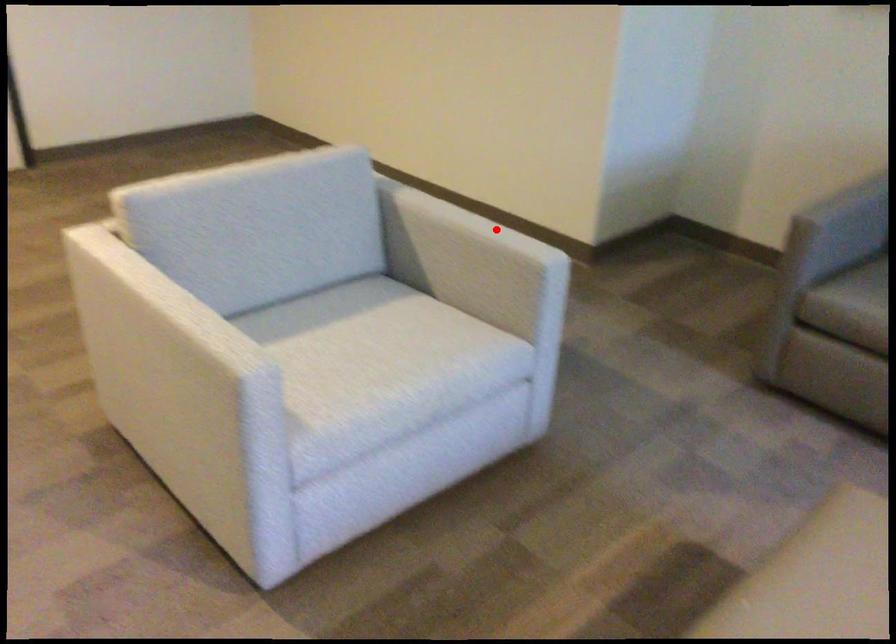
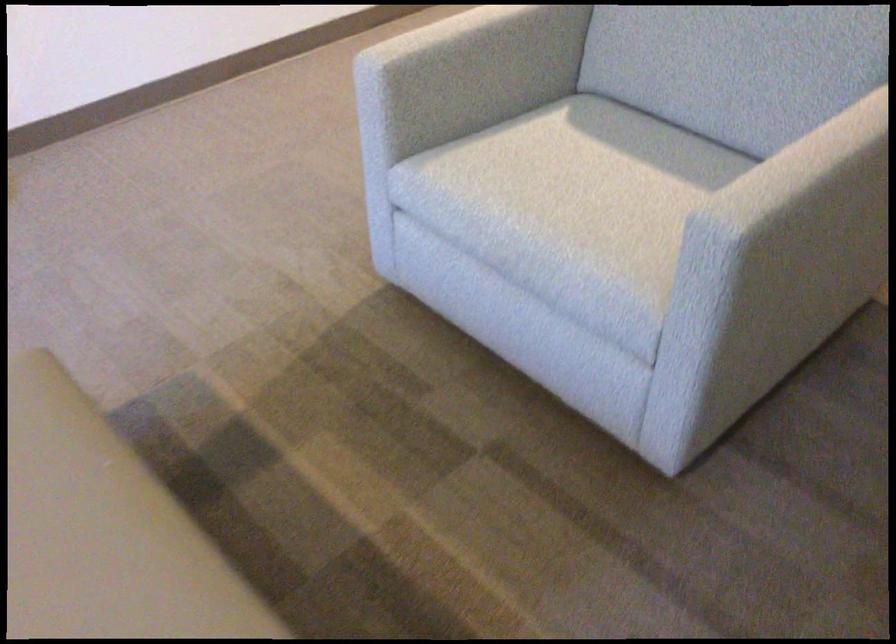
Question: I am providing you with two images of the same scene from different viewpoints. A red point is shown in image1. For the corresponding object point in image2, is it positioned nearer or farther from the camera?

Choices:
 (A) Nearer
 (B) Farther

Answer: (A)